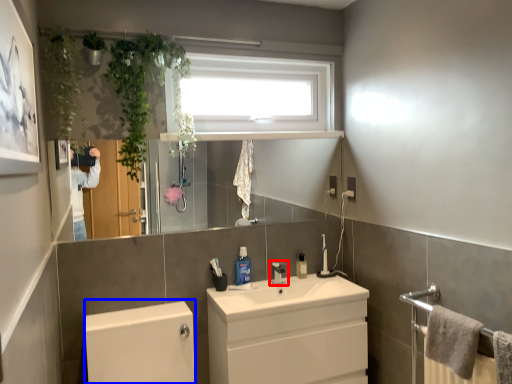
Question: Among these objects, which one is farthest to the camera, tap (highlighted by a red box) or bath (highlighted by a blue box)?

Choices:
 (A) tap
 (B) bath

Answer: (A)